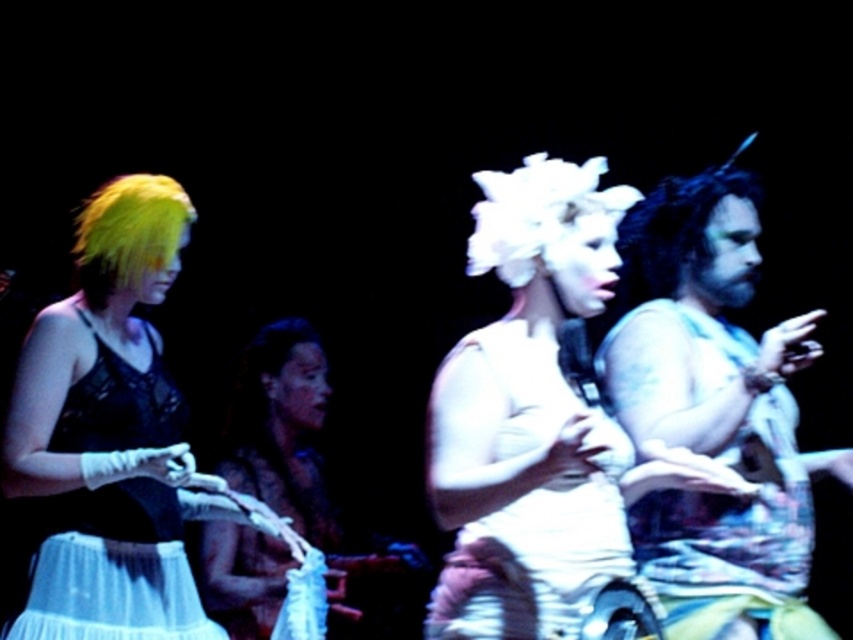
Can you confirm if bearded man with tattoos at right is positioned to the left of white cotton tank top at center?

No, bearded man with tattoos at right is not to the left of white cotton tank top at center.

Can you confirm if bearded man with tattoos at right is thinner than white cotton tank top at center?

In fact, bearded man with tattoos at right might be wider than white cotton tank top at center.

Between point (785, 492) and point (599, 490), which one is positioned in front?

Positioned in front is point (599, 490).

Identify the location of bearded man with tattoos at right. The height and width of the screenshot is (640, 853). click(x=714, y=410).

Which is in front, point (520, 426) or point (32, 557)?

Point (520, 426) is more forward.

Looking at this image, is white fluffy wig at center shorter than black lace dress at left?

No, white fluffy wig at center is not shorter than black lace dress at left.

Who is more distant from viewer, [567,218] or [86,524]?

Point [86,524]

Identify the location of white fluffy wig at center. (537, 420).

Is point (119, 365) positioned behind point (175, 221)?

No.

Who is more distant from viewer, (x=4, y=632) or (x=100, y=294)?

Positioned behind is point (x=100, y=294).

Find the location of a particular element. This screenshot has height=640, width=853. black lace dress at left is located at coordinates (109, 566).